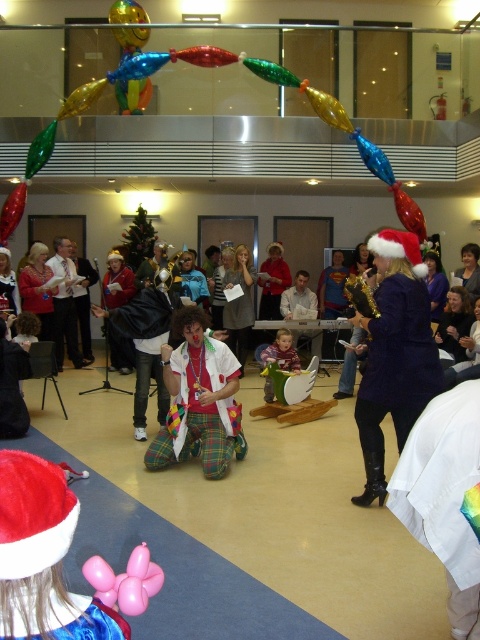
Is point (381, 392) positioned in front of point (142, 588)?

No.

Is point (406, 368) positioned before point (135, 570)?

No, it is behind (135, 570).

The width and height of the screenshot is (480, 640). I want to click on purple fabric coat at center, so click(395, 355).

Which of these two, plaid fabric clown at center or matte green plush toy at center, stands shorter?

matte green plush toy at center is shorter.

Which is below, plaid fabric clown at center or matte green plush toy at center?

plaid fabric clown at center is below.

Between point (236, 429) and point (266, 380), which one is positioned in front?

Point (236, 429) is more forward.

Where is `plaid fabric clown at center`? The image size is (480, 640). plaid fabric clown at center is located at coordinates (199, 401).

Between pink rubber balloon at lower left and matte green plush toy at center, which one has less height?

Standing shorter between the two is pink rubber balloon at lower left.

Locate an element on the screen. This screenshot has width=480, height=640. pink rubber balloon at lower left is located at coordinates (126, 580).